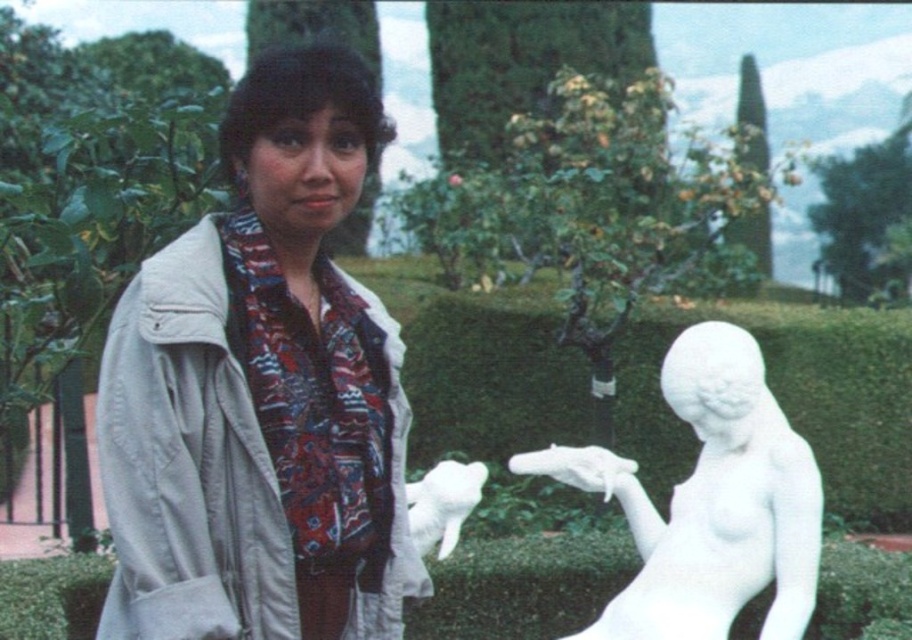
Question: Is white matte jacket at upper left to the left of white glossy statue at center from the viewer's perspective?

Choices:
 (A) yes
 (B) no

Answer: (A)

Question: Can you confirm if white matte jacket at upper left is thinner than white marble statue at right?

Choices:
 (A) yes
 (B) no

Answer: (A)

Question: Which object is the farthest from the white glossy statue at center?

Choices:
 (A) white matte jacket at upper left
 (B) white marble statue at right

Answer: (A)

Question: Which of the following is the closest to the observer?

Choices:
 (A) (246, 513)
 (B) (432, 310)
 (C) (728, 392)

Answer: (A)

Question: Among these objects, which one is farthest from the camera?

Choices:
 (A) white marble statue at right
 (B) white matte jacket at upper left

Answer: (A)

Question: Is white glossy statue at center bigger than white marble statue at right?

Choices:
 (A) no
 (B) yes

Answer: (B)